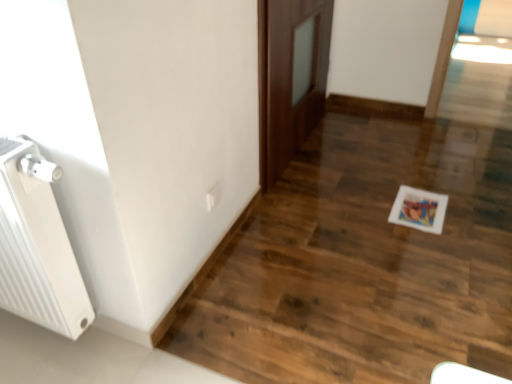
Question: From a real-world perspective, is brown wooden door at center positioned above or below white plastic electric outlet at lower center?

Choices:
 (A) below
 (B) above

Answer: (B)

Question: Considering the positions of point (315, 96) and point (207, 205), is point (315, 96) closer or farther from the camera than point (207, 205)?

Choices:
 (A) farther
 (B) closer

Answer: (A)

Question: Which object is positioned farthest from the white ribbed radiator at left?

Choices:
 (A) white plastic electric outlet at lower center
 (B) brown wooden door at center

Answer: (B)

Question: Which object is the closest to the brown wooden door at center?

Choices:
 (A) white ribbed radiator at left
 (B) white plastic electric outlet at lower center

Answer: (B)